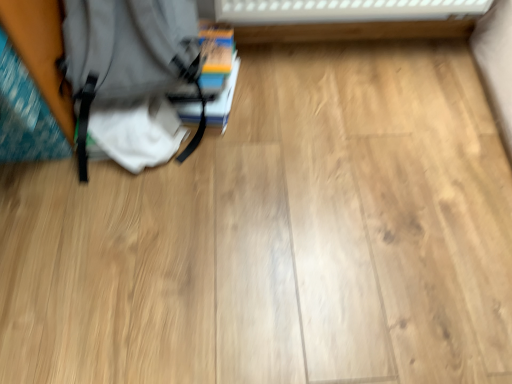
Identify the location of vacant space to the right of matte gray backpack at left. (260, 151).